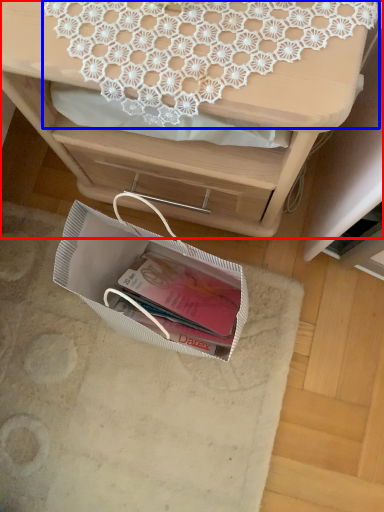
Question: Which object appears farthest to the camera in this image, desk (highlighted by a red box) or lace (highlighted by a blue box)?

Choices:
 (A) desk
 (B) lace

Answer: (B)